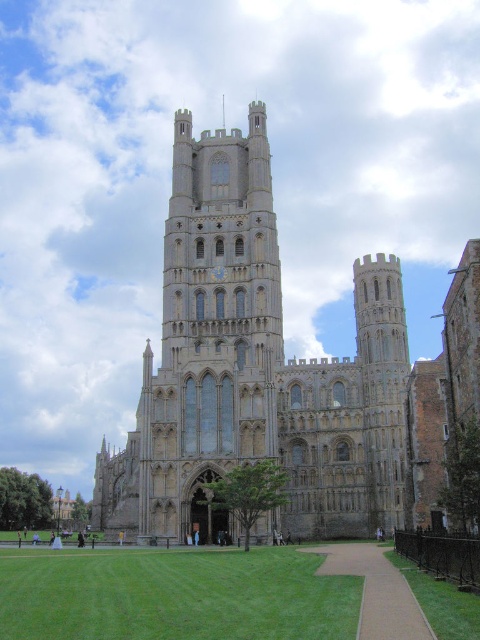
Question: Which object is the farthest from the stone church at center?

Choices:
 (A) green grass at lower center
 (B) green grass at lower right
 (C) light brown paved path at lower center

Answer: (B)

Question: Observing the image, what is the correct spatial positioning of stone church at center in reference to green grass at lower right?

Choices:
 (A) right
 (B) left

Answer: (B)

Question: Considering the real-world distances, which object is farthest from the stone church at center?

Choices:
 (A) green grass at lower right
 (B) light brown paved path at lower center
 (C) green grass at lower center

Answer: (A)

Question: Considering the relative positions of green grass at lower center and green grass at lower right in the image provided, where is green grass at lower center located with respect to green grass at lower right?

Choices:
 (A) left
 (B) right

Answer: (A)

Question: Which of these objects is positioned farthest from the green grass at lower center?

Choices:
 (A) stone church at center
 (B) green grass at lower right
 (C) light brown paved path at lower center

Answer: (A)

Question: Is the position of light brown paved path at lower center less distant than that of green grass at lower right?

Choices:
 (A) yes
 (B) no

Answer: (A)